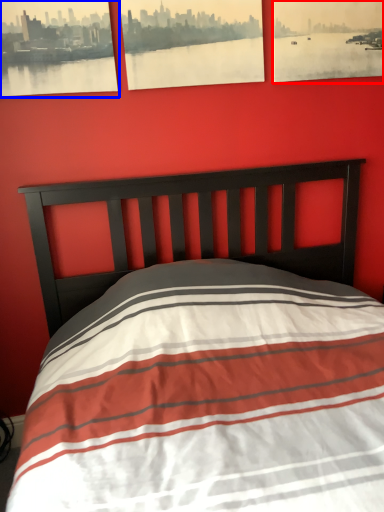
Question: Which point is further to the camera, picture frame (highlighted by a red box) or picture frame (highlighted by a blue box)?

Choices:
 (A) picture frame
 (B) picture frame

Answer: (A)